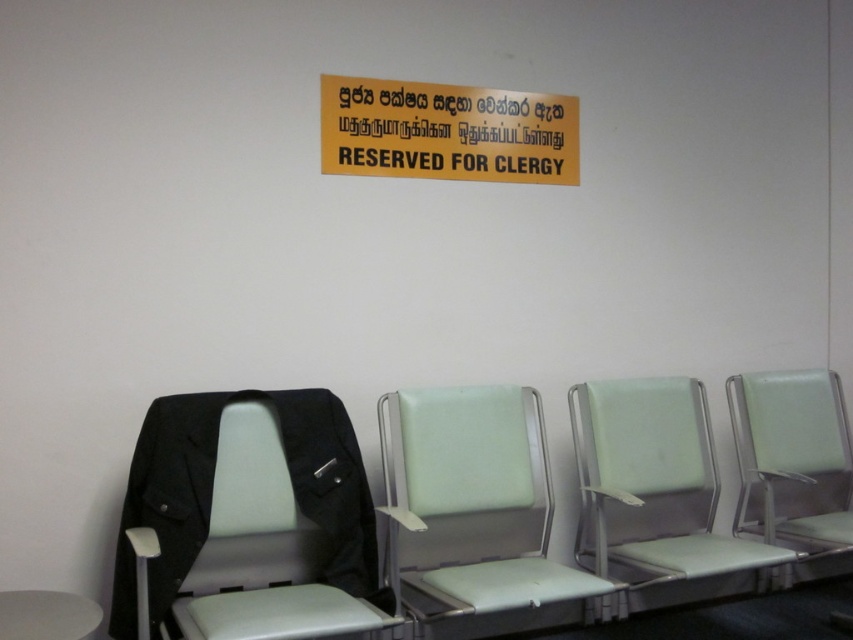
Question: Which point is closer to the camera?

Choices:
 (A) (448, 483)
 (B) (735, 401)
 (C) (650, 529)

Answer: (A)

Question: Which point is farther from the camera taking this photo?

Choices:
 (A) (83, 627)
 (B) (393, 397)

Answer: (B)

Question: Does yellow matte signboard at upper center have a larger size compared to light green plastic chair at right?

Choices:
 (A) no
 (B) yes

Answer: (A)

Question: Which point is farther to the camera?

Choices:
 (A) yellow matte signboard at upper center
 (B) matte black chair at left
 (C) light green fabric chair at center
 (D) light green plastic chair at right

Answer: (A)

Question: Is light green fabric chair at center to the left of yellow matte signboard at upper center from the viewer's perspective?

Choices:
 (A) no
 (B) yes

Answer: (A)

Question: Does light green plastic chair at center have a greater width compared to yellow matte signboard at upper center?

Choices:
 (A) yes
 (B) no

Answer: (B)